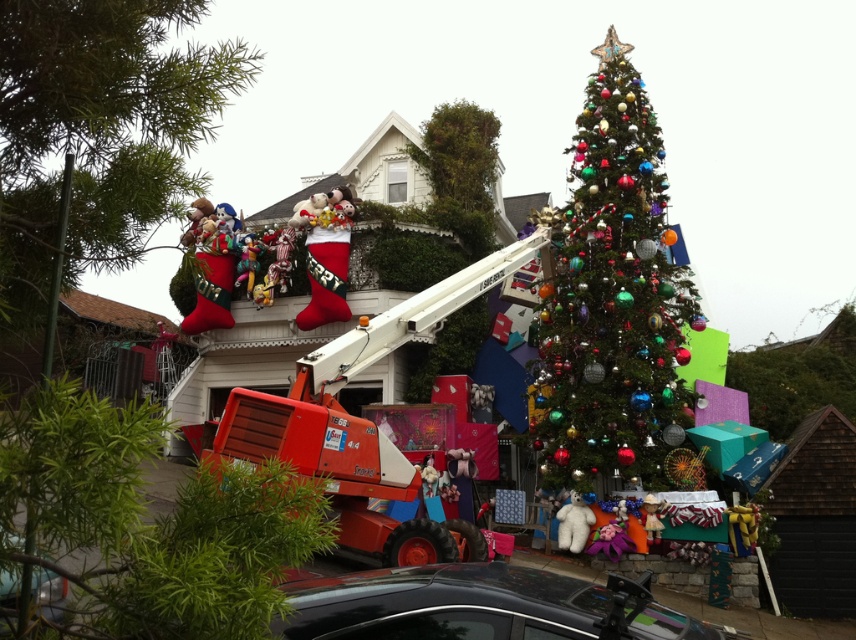
You are a delivery person who needs to park your metallic silver car at lower left near the shiny metallic tree at center. Based on their sizes, will the car fit in the space next to the tree without touching it?

The shiny metallic tree at center is wider than the metallic silver car at lower left, so there should be enough space for the car to park next to the tree without touching it.

Looking at this image, you are a delivery person who needs to park your metallic silver car at lower left near the shiny metallic tree at center. Can you park the car directly under the tree without any obstruction?

The shiny metallic tree at center is above the metallic silver car at lower left, so yes, you can park the metallic silver car at lower left directly under the tree without any obstruction.

Consider the image. You are a delivery person who needs to unload a package from the metallic silver car at lower left and place it near the velvet plush santa at center. Can you directly walk from the car to the santa without any obstacles?

The velvet plush santa at center is located above the metallic silver car at lower left, so you can directly walk from the metallic silver car at lower left to the velvet plush santa at center without any obstacles.